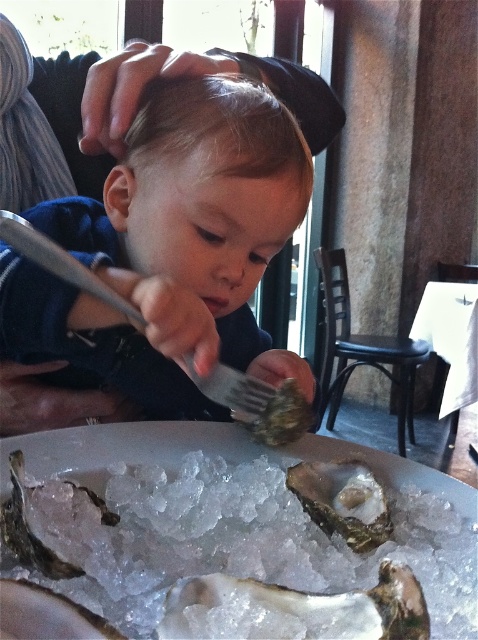
In the scene shown: You are a photographer trying to capture the child and the oysters in focus. Since the matte black shirt at center and the white pearl oyster at center are both in the scene, which one would you adjust your camera focus on first if you want both to be clear?

The matte black shirt at center is bigger than the white pearl oyster at center, so adjusting focus on the larger matte black shirt at center first would help ensure both are in focus.

Looking at this image, you are a photographer standing at the camera position. You want to take a photo of the scene such that the point at point (220, 390) is in focus. The camera has a depth of field that can only keep objects within 20 inches from the camera in focus. Will the point be in focus?

The distance of point (220, 390) from camera is 19.66 inches, which is within the 20 inches depth of field. Therefore, the point will be in focus.

You are a waiter in a seafood restaurant. You need to place a new order of oysters on the table. The table has two spots available at coordinates point (x=252, y=420) and point (x=19, y=502). The customer prefers the oysters to be closer to the window for better lighting. Which coordinate should you choose?

Point (x=19, y=502) is closer to the window, so you should place the oysters there to meet the customer preference.